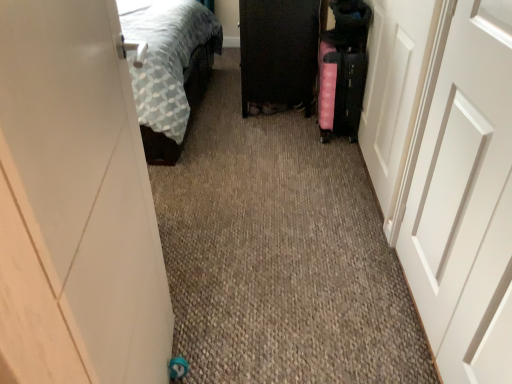
Identify the location of free point to the left of white matte door at right, arranged as the 2th door when viewed from the right. (311, 320).